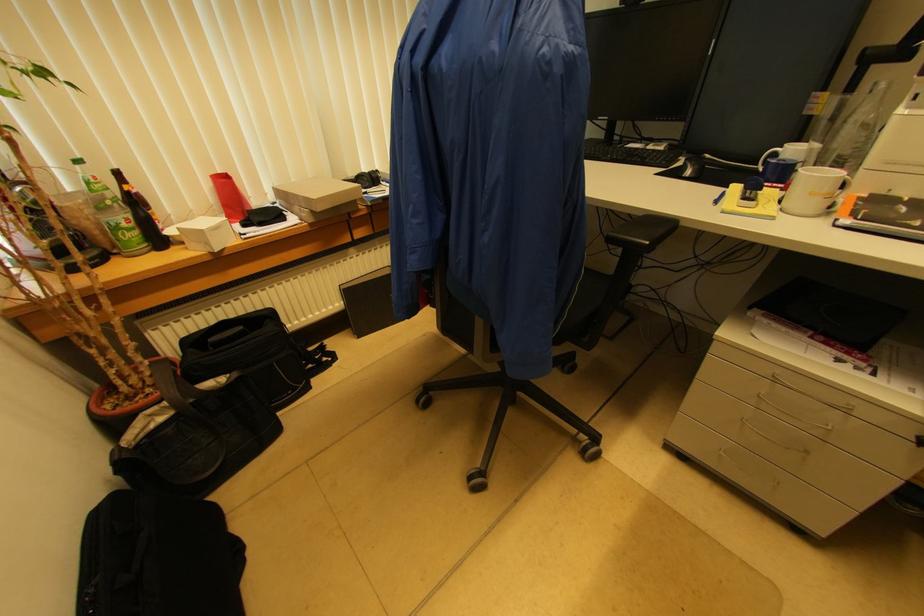
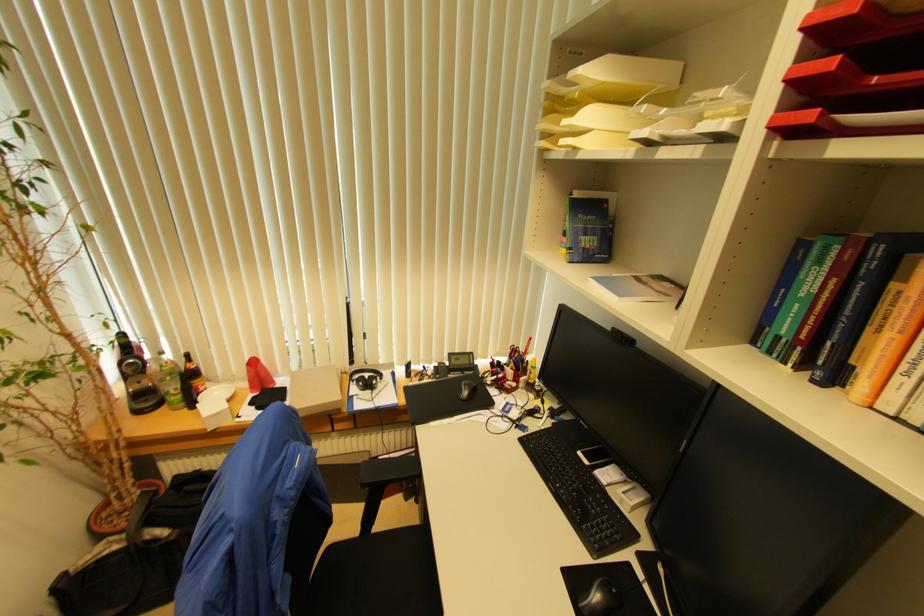
In the second image, find the point that corresponds to point (126, 227) in the first image.

(174, 394)